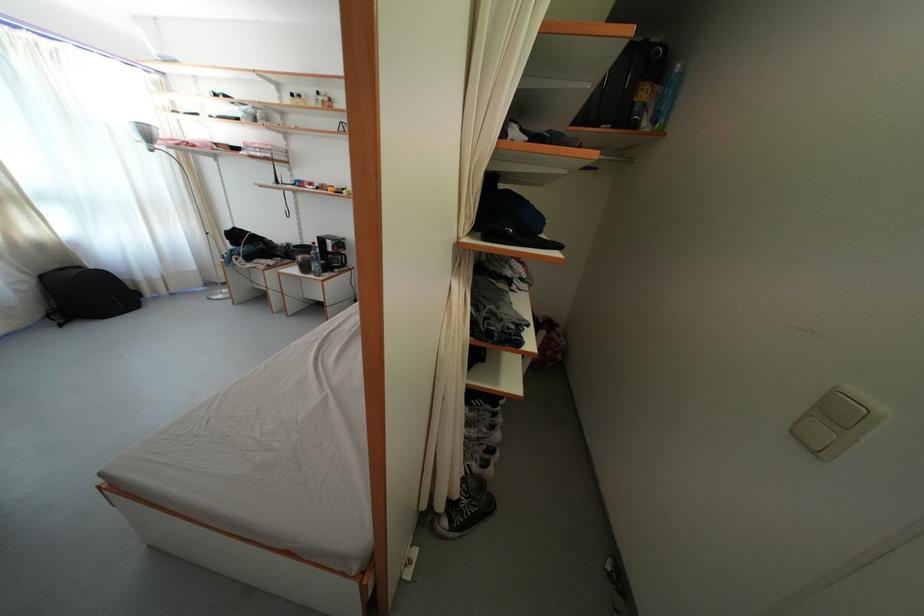
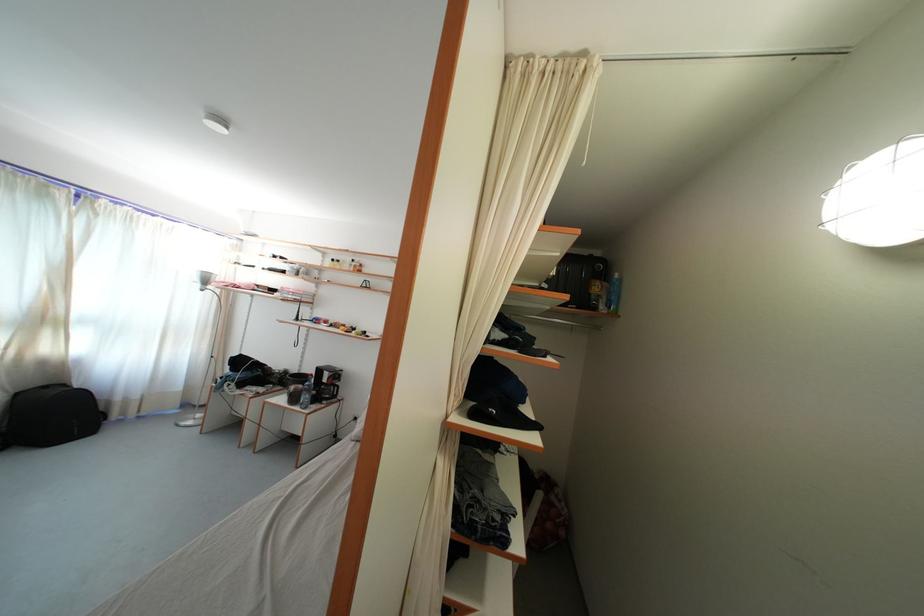
The point at (x=163, y=282) is marked in the first image. Where is the corresponding point in the second image?

(141, 403)